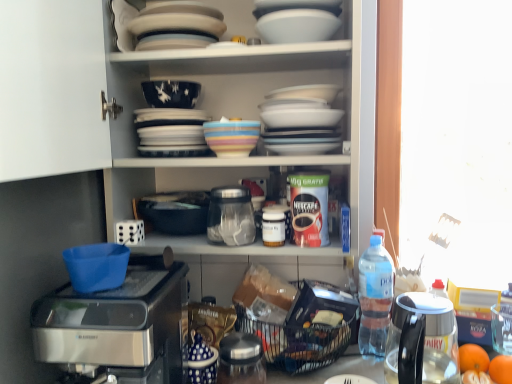
The height and width of the screenshot is (384, 512). In order to click on vacant area on top of black plastic basket at lower center (from a real-world perspective) in this screenshot , I will do `click(291, 318)`.